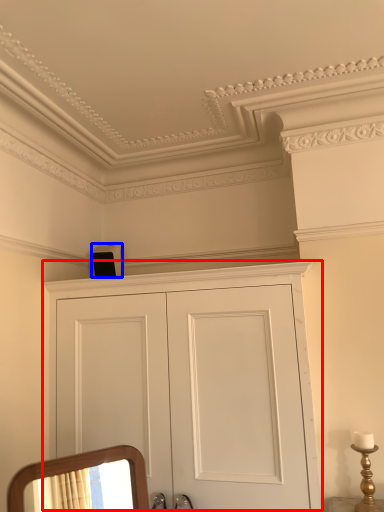
Question: Which of the following is the closest to the observer, cupboard (highlighted by a red box) or speaker (highlighted by a blue box)?

Choices:
 (A) cupboard
 (B) speaker

Answer: (A)